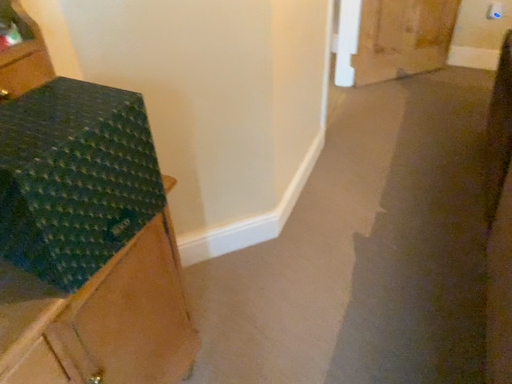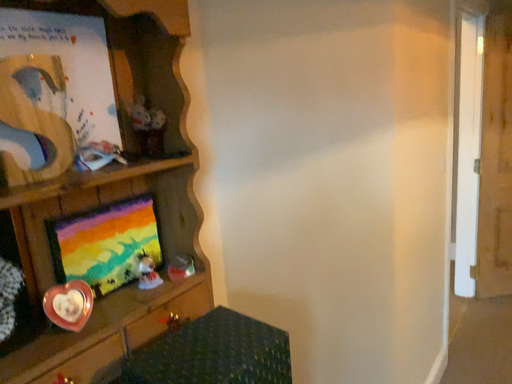
Question: Which way did the camera rotate in the video?

Choices:
 (A) rotated upward
 (B) rotated downward

Answer: (A)